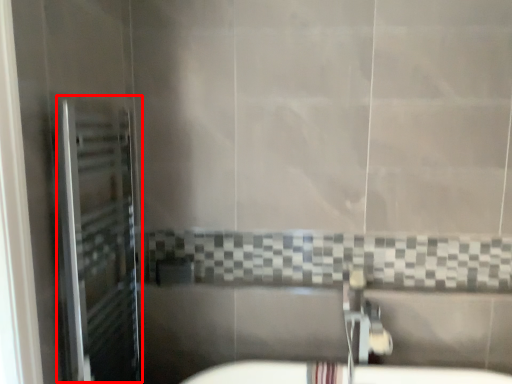
Question: Considering the relative positions of screen door (annotated by the red box) and plumbing fixture in the image provided, where is screen door (annotated by the red box) located with respect to the staircase?

Choices:
 (A) right
 (B) left

Answer: (B)